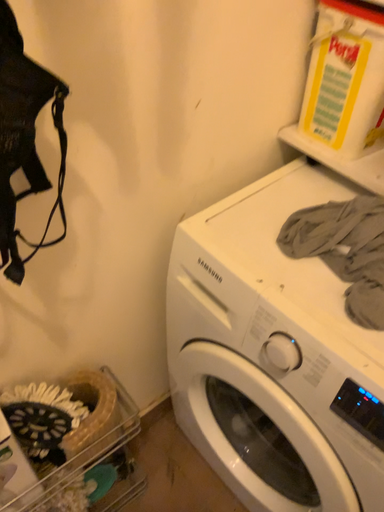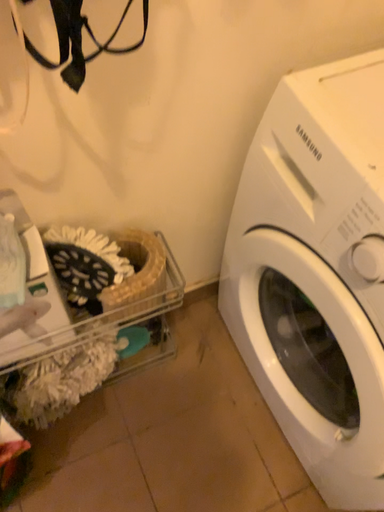
Question: Which way did the camera rotate in the video?

Choices:
 (A) rotated left
 (B) rotated right

Answer: (A)